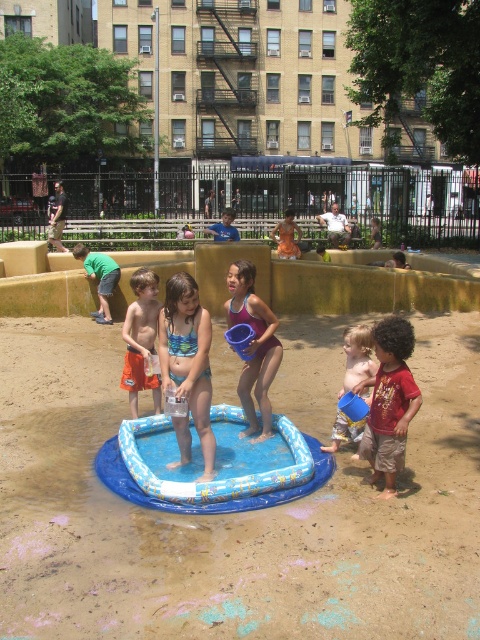
Question: Considering the real-world distances, which object is closest to the orange fabric dress at center?

Choices:
 (A) matte purple swimsuit at center
 (B) blue printed swimsuit at center
 (C) green cotton shirt at left
 (D) blue plastic bucket at center

Answer: (C)

Question: In this image, where is blue printed swimsuit at center located relative to brown cotton shorts at lower right?

Choices:
 (A) below
 (B) above

Answer: (B)

Question: Is matte purple swimsuit at center to the right of blue plastic bucket at center from the viewer's perspective?

Choices:
 (A) no
 (B) yes

Answer: (A)

Question: Does blue printed swimsuit at center have a lesser width compared to orange swim trunks at center?

Choices:
 (A) yes
 (B) no

Answer: (B)

Question: Among these points, which one is nearest to the camera?

Choices:
 (A) (240, 392)
 (B) (394, 376)

Answer: (B)

Question: Which object appears farthest from the camera in this image?

Choices:
 (A) orange swim trunks at center
 (B) orange fabric dress at center
 (C) matte purple swimsuit at center
 (D) blue rubber pool at center

Answer: (B)